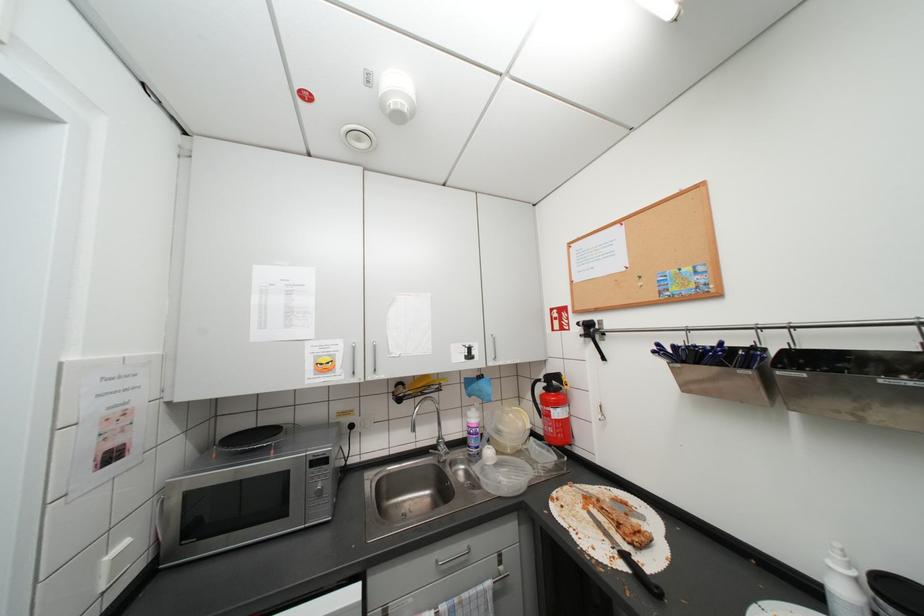
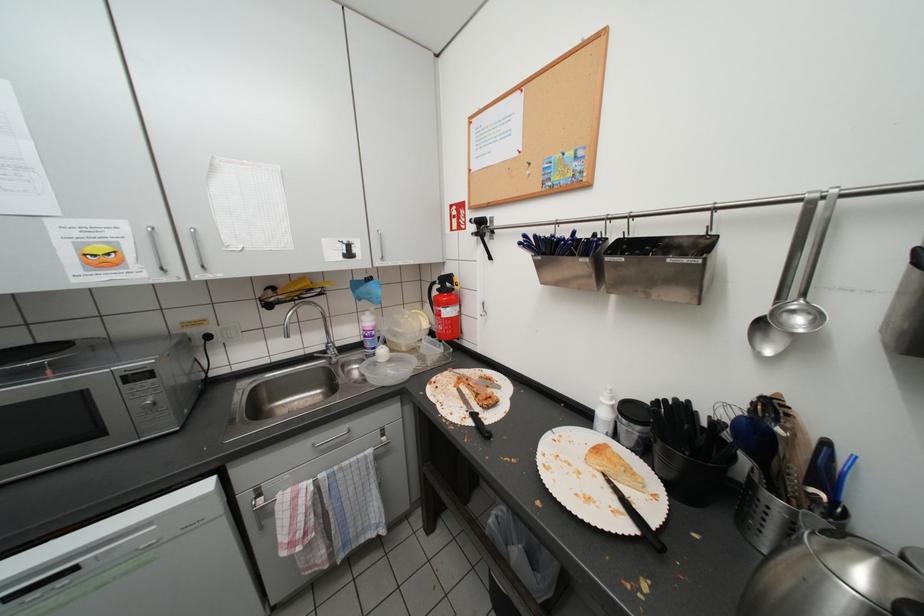
Question: The images are taken continuously from a first-person perspective. In which direction are you moving?

Choices:
 (A) Left
 (B) Right
 (C) Forward
 (D) Backward

Answer: (B)